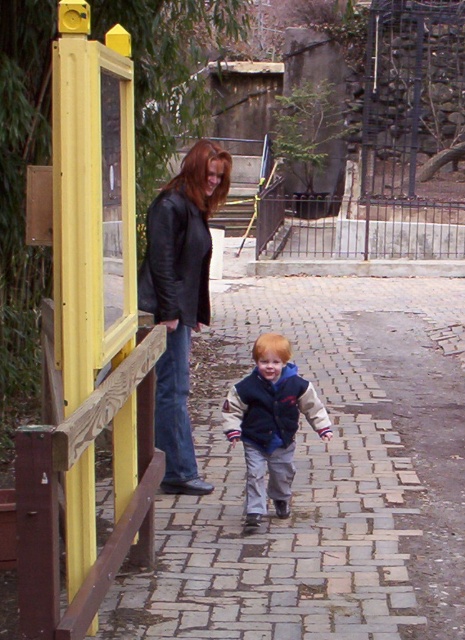
You are a zoo visitor standing on the paved pathway. You see the matte black leather jacket at upper left and the velvet blue jacket at center. Which jacket is positioned higher in the image?

The matte black leather jacket at upper left is taller than the velvet blue jacket at center, so it is positioned higher in the image.